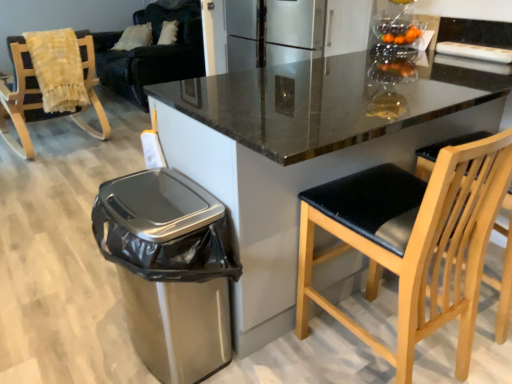
Question: Could you tell me if satin silver trash can at lower left is turned towards wooden rocking chair with fringed blanket at left, the 2th chair positioned from the front?

Choices:
 (A) no
 (B) yes

Answer: (A)

Question: Does satin silver trash can at lower left have a smaller size compared to wooden rocking chair with fringed blanket at left, the first chair from the back?

Choices:
 (A) no
 (B) yes

Answer: (B)

Question: Is satin silver trash can at lower left looking in the opposite direction of wooden rocking chair with fringed blanket at left, the 2th chair positioned from the front?

Choices:
 (A) no
 (B) yes

Answer: (A)

Question: From the image's perspective, would you say satin silver trash can at lower left is positioned over wooden rocking chair with fringed blanket at left, the 2th chair positioned from the front?

Choices:
 (A) yes
 (B) no

Answer: (B)

Question: Does satin silver trash can at lower left lie behind wooden rocking chair with fringed blanket at left, which is the 2th chair from bottom to top?

Choices:
 (A) no
 (B) yes

Answer: (A)

Question: Would you say satin silver trash can at lower left is a long distance from wooden rocking chair with fringed blanket at left, the first chair from the back?

Choices:
 (A) no
 (B) yes

Answer: (B)

Question: Is dark blue fabric couch at upper left behind black leather chair at right, positioned as the first chair in right-to-left order?

Choices:
 (A) no
 (B) yes

Answer: (B)

Question: Is dark blue fabric couch at upper left wider than black leather chair at right, the 1th chair when ordered from bottom to top?

Choices:
 (A) no
 (B) yes

Answer: (B)

Question: Considering the relative sizes of dark blue fabric couch at upper left and black leather chair at right, the 1th chair when ordered from bottom to top, in the image provided, is dark blue fabric couch at upper left shorter than black leather chair at right, the 1th chair when ordered from bottom to top,?

Choices:
 (A) yes
 (B) no

Answer: (B)

Question: Is black leather chair at right, the 2th chair viewed from the top, at the back of dark blue fabric couch at upper left?

Choices:
 (A) no
 (B) yes

Answer: (A)

Question: Is the depth of dark blue fabric couch at upper left less than that of black leather chair at right, positioned as the first chair in right-to-left order?

Choices:
 (A) yes
 (B) no

Answer: (B)

Question: From a real-world perspective, is dark blue fabric couch at upper left on top of black leather chair at right, the 2th chair viewed from the top?

Choices:
 (A) yes
 (B) no

Answer: (A)

Question: From the image's perspective, is dark blue fabric couch at upper left beneath satin silver trash can at lower left?

Choices:
 (A) no
 (B) yes

Answer: (A)